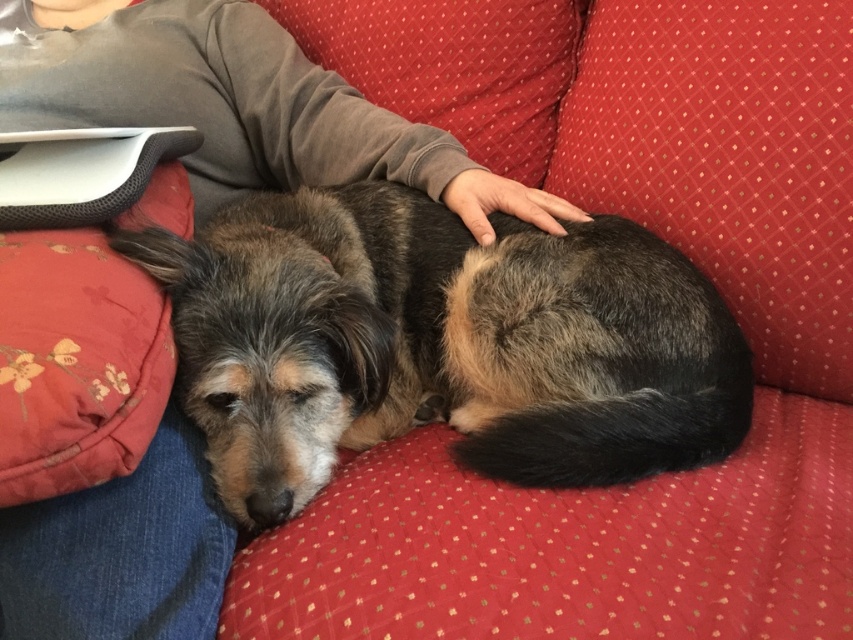
Question: Which point is farther to the camera?

Choices:
 (A) brown fur dog at center
 (B) floral-patterned fabric pillow at lower left
 (C) gray fleece sweater at upper left

Answer: (C)

Question: Can you confirm if brown fur dog at center is smaller than floral-patterned fabric pillow at lower left?

Choices:
 (A) yes
 (B) no

Answer: (B)

Question: Where is gray fleece sweater at upper left located in relation to floral-patterned fabric pillow at lower left in the image?

Choices:
 (A) above
 (B) below

Answer: (A)

Question: Can you confirm if brown fur dog at center is wider than floral-patterned fabric pillow at lower left?

Choices:
 (A) no
 (B) yes

Answer: (B)

Question: Which point appears closest to the camera in this image?

Choices:
 (A) (178, 552)
 (B) (416, 353)

Answer: (A)

Question: Estimate the real-world distances between objects in this image. Which object is closer to the floral-patterned fabric pillow at lower left?

Choices:
 (A) brown fur dog at center
 (B) gray fleece sweater at upper left

Answer: (A)